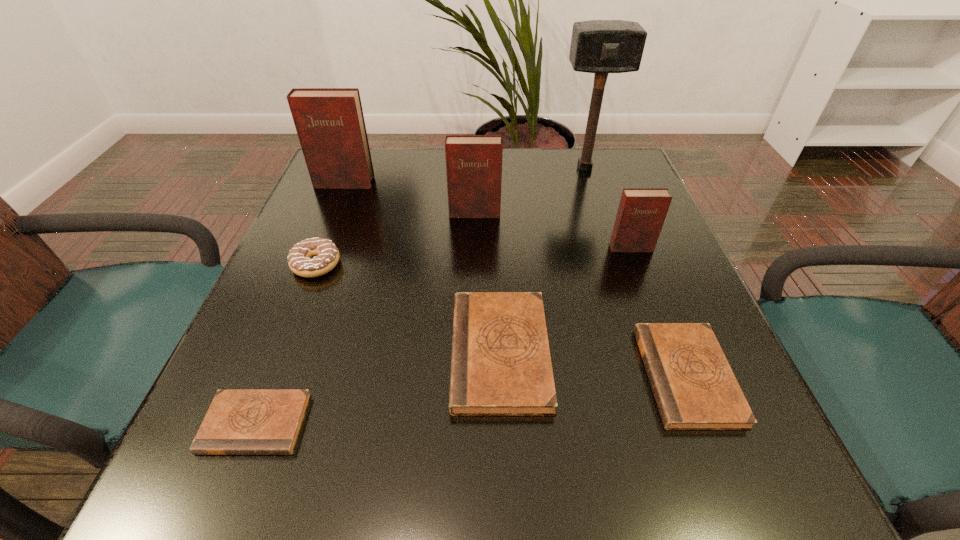
I want to click on free location that satisfies the following two spatial constraints: 1. on the front cover of the doughnut; 2. on the right side of the second tallest object, so click(311, 265).

At what (x,y) coordinates should I click in order to perform the action: click on free region that satisfies the following two spatial constraints: 1. on the front cover of the biggest reddish-brown diary; 2. on the left side of the doughnut. Please return your answer as a coordinate pair (x, y). This screenshot has height=540, width=960. Looking at the image, I should click on (311, 265).